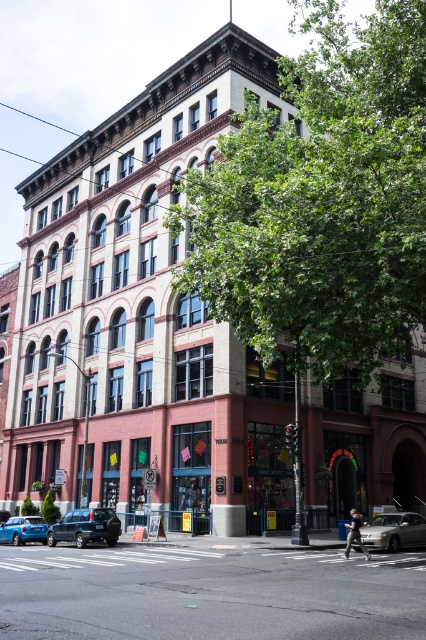
You are a delivery person trying to park your silver metallic sedan at lower right near the black asphalt at center. Can you fit your car there without overlapping the sidewalk?

The black asphalt at center might be wider than the silver metallic sedan at lower right, so there is a possibility that the car can fit without overlapping the sidewalk. However, the exact width isn not specified, so caution is advised.

You are a pedestrian standing on the sidewalk and want to cross the street to reach the building. There is a black asphalt at center and a metallic blue sedan at lower left. Which object should you avoid stepping on to stay on the sidewalk?

You should avoid stepping on the metallic blue sedan at lower left because the black asphalt at center is in front of it, indicating the sedan is parked on the road, not the sidewalk.